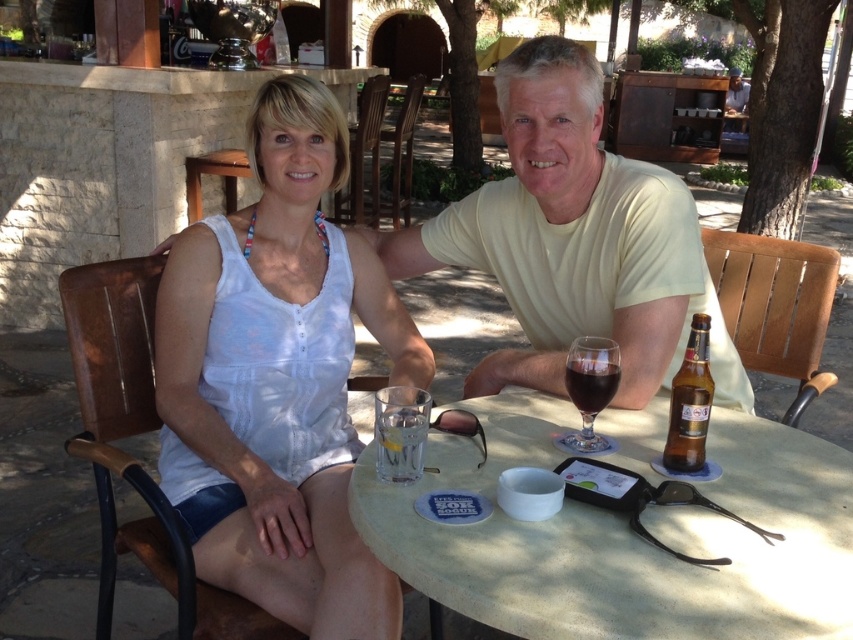
Can you confirm if white fabric tank top at center is positioned above dark glass wine at center?

Yes, white fabric tank top at center is above dark glass wine at center.

Is white fabric tank top at center positioned in front of dark glass wine at center?

That is True.

At what (x,y) coordinates should I click in order to perform the action: click on white fabric tank top at center. Please return your answer as a coordinate pair (x, y). The height and width of the screenshot is (640, 853). Looking at the image, I should click on (277, 378).

Where is `white fabric tank top at center`? white fabric tank top at center is located at coordinates (277, 378).

Measure the distance between point (645, 582) and camera.

They are 39.05 inches apart.

From the picture: Is the position of smooth stone table at center more distant than that of white fabric shirt at upper center?

No, smooth stone table at center is in front of white fabric shirt at upper center.

From the picture: Measure the distance between point (531, 428) and camera.

The distance of point (531, 428) from camera is 1.43 meters.

Identify the location of smooth stone table at center. (627, 538).

Between white fabric shirt at upper center and brown glass bottle at table right, which one has more height?

Standing taller between the two is white fabric shirt at upper center.

Which is behind, point (425, 241) or point (691, 452)?

The point (425, 241) is behind.

Find the location of a particular element. This screenshot has height=640, width=853. white fabric shirt at upper center is located at coordinates (575, 241).

In order to click on white fabric shirt at upper center in this screenshot , I will do (x=575, y=241).